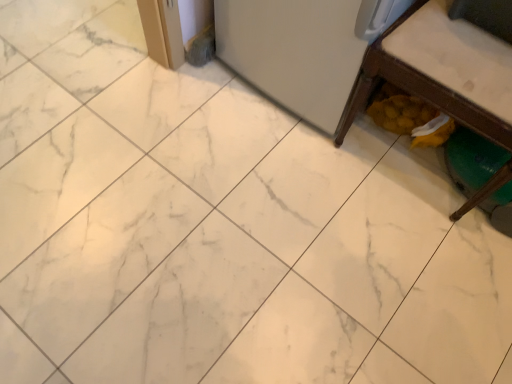
What is the approximate height of wooden bench at lower right?

27.65 inches.

Describe the element at coordinates (442, 70) in the screenshot. I see `wooden bench at lower right` at that location.

The height and width of the screenshot is (384, 512). Find the location of `wooden bench at lower right`. wooden bench at lower right is located at coordinates (442, 70).

Find the location of a particular element. Image resolution: width=512 pixels, height=384 pixels. wooden bench at lower right is located at coordinates (442, 70).